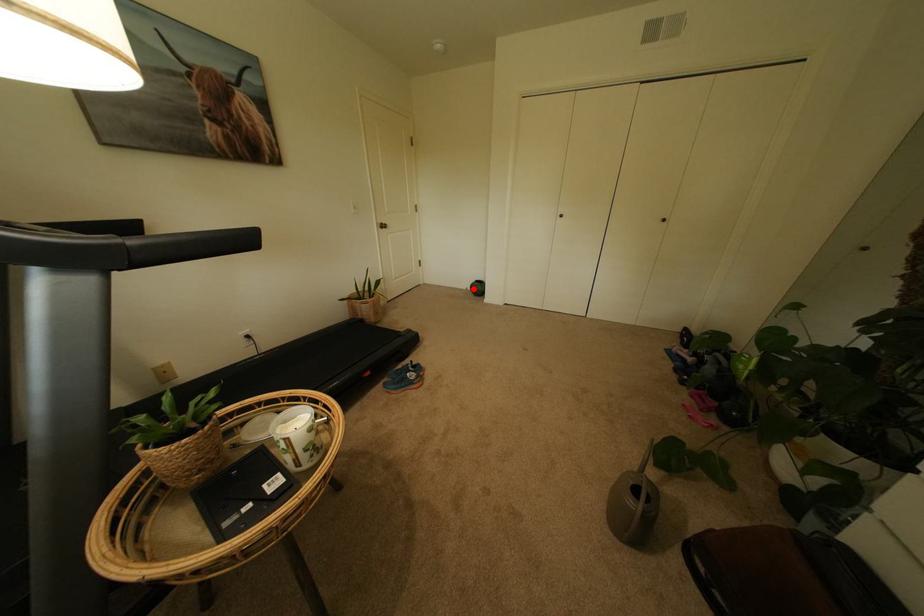
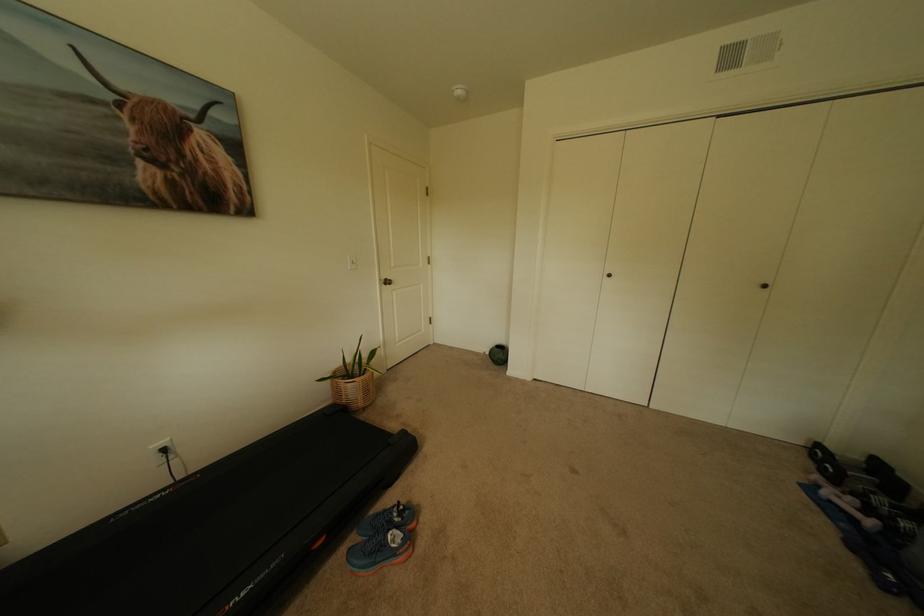
Question: I am providing you with two images of the same scene from different viewpoints. Given a red point in image1, look at the same physical point in image2. Is it:

Choices:
 (A) Closer to the viewpoint
 (B) Farther from the viewpoint

Answer: (B)